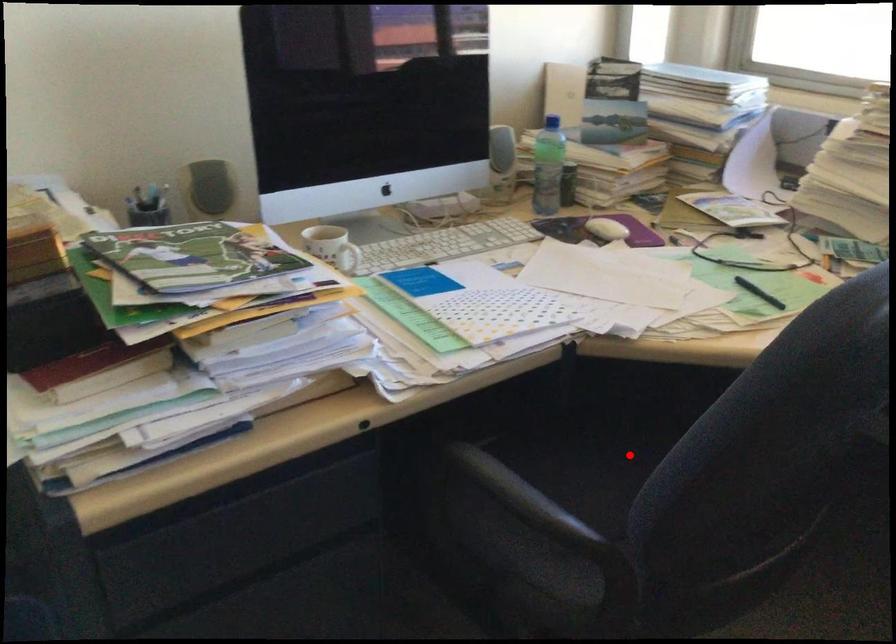
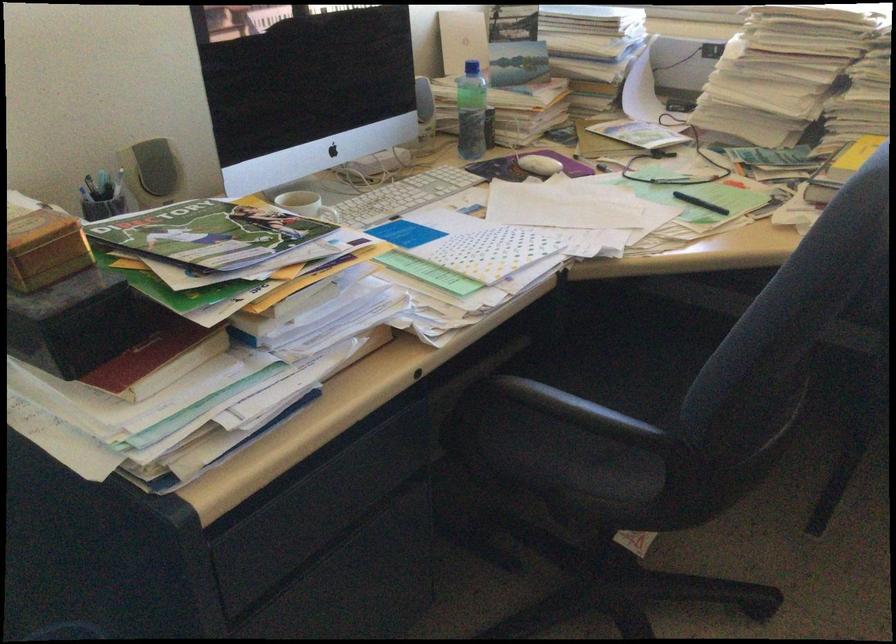
In the second image, find the point that corresponds to the highlighted location in the first image.

(618, 365)